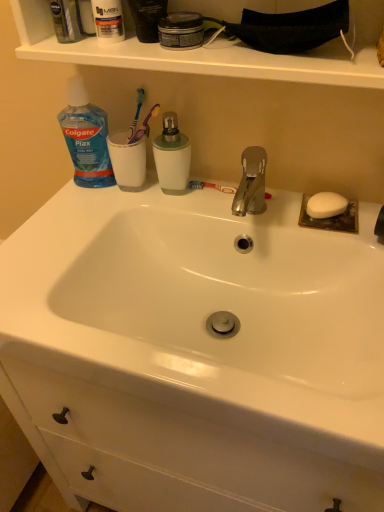
Identify the location of free region on the left part of green matte mouthwash at center, the first mouthwash in the bottom-to-top sequence. The height and width of the screenshot is (512, 384). (87, 215).